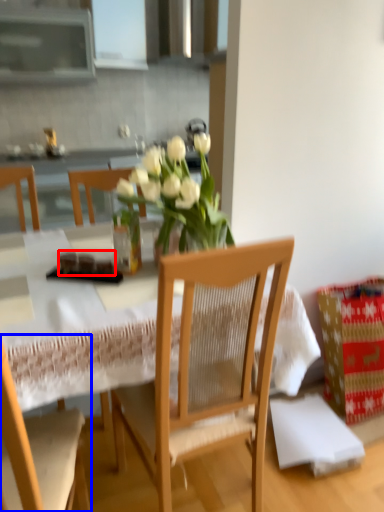
Question: Which object is closer to the camera taking this photo, food (highlighted by a red box) or chair (highlighted by a blue box)?

Choices:
 (A) food
 (B) chair

Answer: (B)